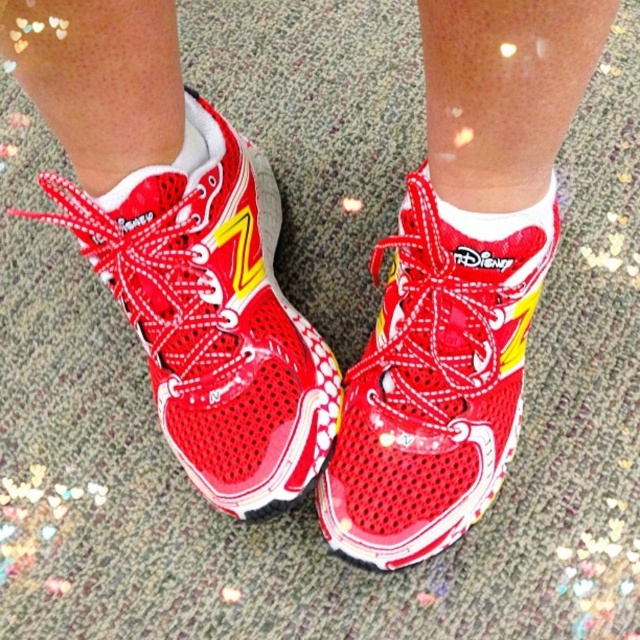
Question: Does shiny red shoe at center appear on the left side of white soft sock at center?

Choices:
 (A) no
 (B) yes

Answer: (B)

Question: Which of the following is the closest to the observer?

Choices:
 (A) (504, 227)
 (B) (193, 129)

Answer: (A)

Question: Which object appears closest to the camera in this image?

Choices:
 (A) shiny red running shoe at center
 (B) white fabric sock at center
 (C) shiny red shoe at center

Answer: (A)

Question: Does shiny red running shoe at center appear over white fabric sock at center?

Choices:
 (A) yes
 (B) no

Answer: (B)

Question: Does shiny red shoe at center have a greater width compared to white soft sock at center?

Choices:
 (A) no
 (B) yes

Answer: (B)

Question: Estimate the real-world distances between objects in this image. Which object is closer to the white fabric sock at center?

Choices:
 (A) white soft sock at center
 (B) shiny red shoe at center

Answer: (A)